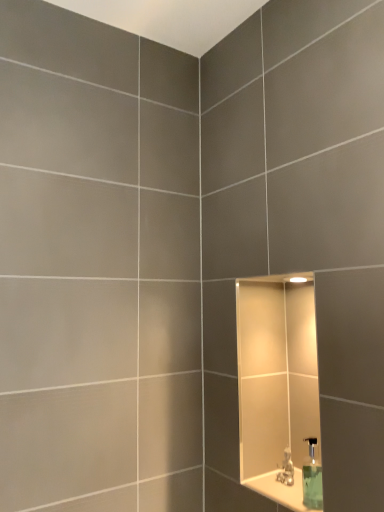
Question: Is green translucent soap dispenser at lower right at the left side of satin nickel faucet at lower right?

Choices:
 (A) no
 (B) yes

Answer: (A)

Question: From a real-world perspective, is green translucent soap dispenser at lower right positioned under satin nickel faucet at lower right based on gravity?

Choices:
 (A) no
 (B) yes

Answer: (A)

Question: Can you confirm if green translucent soap dispenser at lower right is thinner than satin nickel faucet at lower right?

Choices:
 (A) no
 (B) yes

Answer: (A)

Question: Is green translucent soap dispenser at lower right located outside satin nickel faucet at lower right?

Choices:
 (A) yes
 (B) no

Answer: (A)

Question: Considering the relative sizes of green translucent soap dispenser at lower right and satin nickel faucet at lower right in the image provided, is green translucent soap dispenser at lower right taller than satin nickel faucet at lower right?

Choices:
 (A) no
 (B) yes

Answer: (B)

Question: Would you say satin nickel faucet at lower right is part of green translucent soap dispenser at lower right's contents?

Choices:
 (A) yes
 (B) no

Answer: (B)

Question: From a real-world perspective, is satin nickel faucet at lower right positioned under white glossy ledge at lower right based on gravity?

Choices:
 (A) no
 (B) yes

Answer: (A)

Question: Is satin nickel faucet at lower right oriented towards white glossy ledge at lower right?

Choices:
 (A) yes
 (B) no

Answer: (B)

Question: Is satin nickel faucet at lower right wider than white glossy ledge at lower right?

Choices:
 (A) no
 (B) yes

Answer: (A)

Question: Is satin nickel faucet at lower right further to camera compared to white glossy ledge at lower right?

Choices:
 (A) no
 (B) yes

Answer: (B)

Question: Is white glossy ledge at lower right inside satin nickel faucet at lower right?

Choices:
 (A) yes
 (B) no

Answer: (B)

Question: From the image's perspective, is satin nickel faucet at lower right under white glossy ledge at lower right?

Choices:
 (A) no
 (B) yes

Answer: (A)

Question: Considering the relative sizes of white glossy ledge at lower right and green translucent soap dispenser at lower right in the image provided, is white glossy ledge at lower right taller than green translucent soap dispenser at lower right?

Choices:
 (A) no
 (B) yes

Answer: (A)